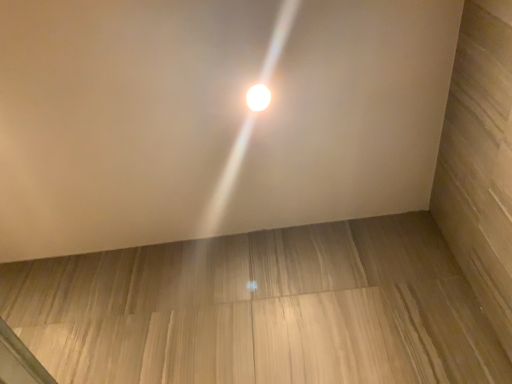
You are a GUI agent. You are given a task and a screenshot of the screen. Output one action in this format:
    pyautogui.click(x=<x>, y=<y>)
    Task: Click on the free spot to the right of white glossy light bulb at upper center
    This screenshot has width=512, height=384.
    Given the screenshot: What is the action you would take?
    pyautogui.click(x=323, y=93)